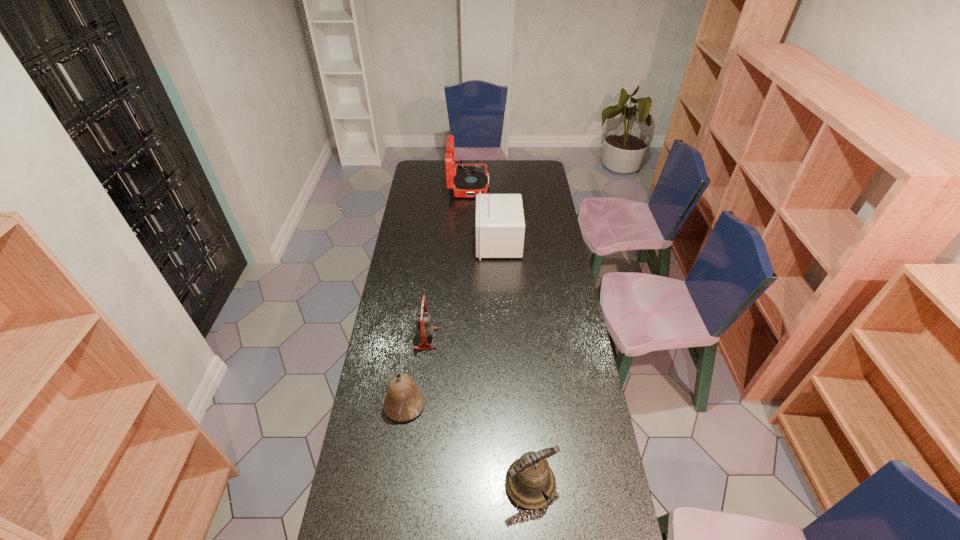
The height and width of the screenshot is (540, 960). What are the coordinates of `blank area located on the back of the farthest bell` in the screenshot? It's located at (431, 289).

Find the location of a particular element. This screenshot has height=540, width=960. free space located 0.330m on the left of the nearest object is located at coordinates (395, 484).

Locate an element on the screen. vacant space located on the back of the second nearest object is located at coordinates (417, 318).

Find the location of a particular element. object present at the far edge is located at coordinates (469, 179).

I want to click on vacant space at the far edge, so click(493, 167).

This screenshot has height=540, width=960. What are the coordinates of `vacant space at the left edge of the desktop` in the screenshot? It's located at (408, 188).

Locate an element on the screen. The height and width of the screenshot is (540, 960). vacant space at the right edge is located at coordinates (540, 225).

The width and height of the screenshot is (960, 540). I want to click on vacant region at the far right corner of the desktop, so click(x=525, y=166).

Locate an element on the screen. This screenshot has width=960, height=540. free point between the nearest object and the second farthest object is located at coordinates (515, 363).

Identify the location of empty location between the phonograph_record and the third nearest object. Image resolution: width=960 pixels, height=540 pixels. (447, 262).